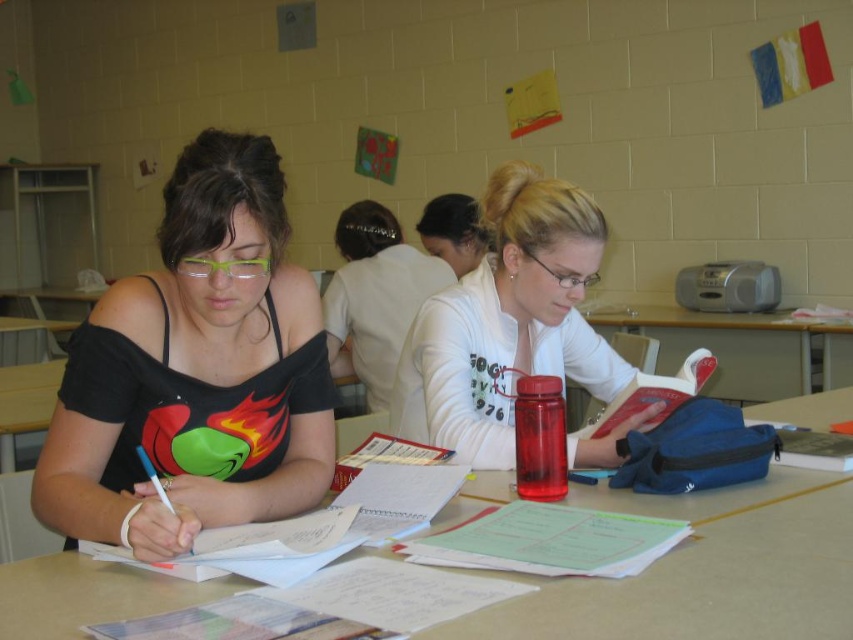
Question: From the image, what is the correct spatial relationship of black matte tank top at left in relation to white paper at center?

Choices:
 (A) above
 (B) below

Answer: (A)

Question: Is matte black tank top at center to the left of white matte sweater at center from the viewer's perspective?

Choices:
 (A) no
 (B) yes

Answer: (B)

Question: Considering the real-world distances, which object is farthest from the blue fabric backpack at right?

Choices:
 (A) black matte tank top at left
 (B) matte black tank top at center
 (C) white matte sweater at center

Answer: (A)

Question: Among these points, which one is nearest to the camera?

Choices:
 (A) (735, 342)
 (B) (148, 605)
 (C) (373, 296)

Answer: (B)

Question: Is matte black tank top at center above blue fabric backpack at right?

Choices:
 (A) no
 (B) yes

Answer: (B)

Question: Among these objects, which one is farthest from the camera?

Choices:
 (A) matte black tank top at center
 (B) matte white sweater at center
 (C) blue fabric backpack at right

Answer: (C)